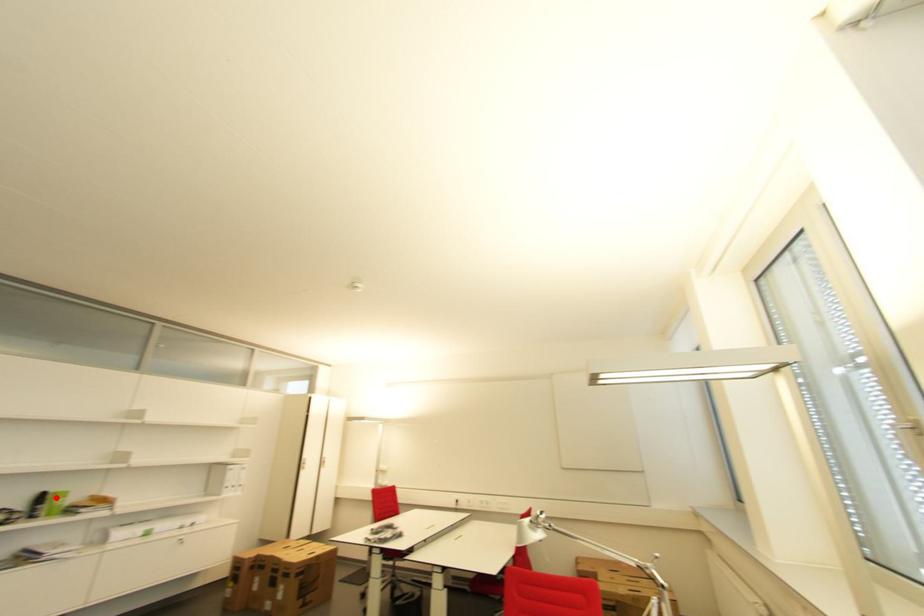
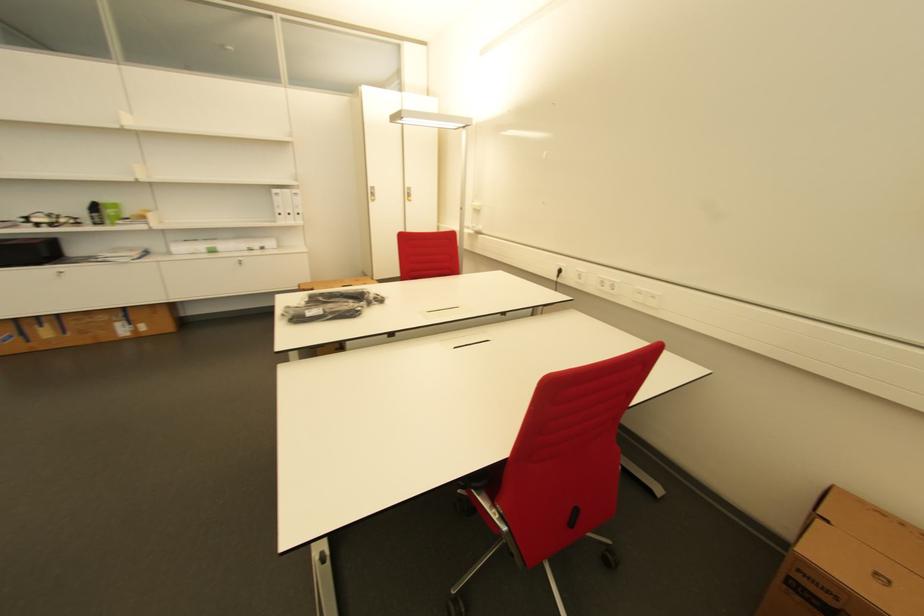
The point at the highlighted location is marked in the first image. Where is the corresponding point in the second image?

(104, 208)